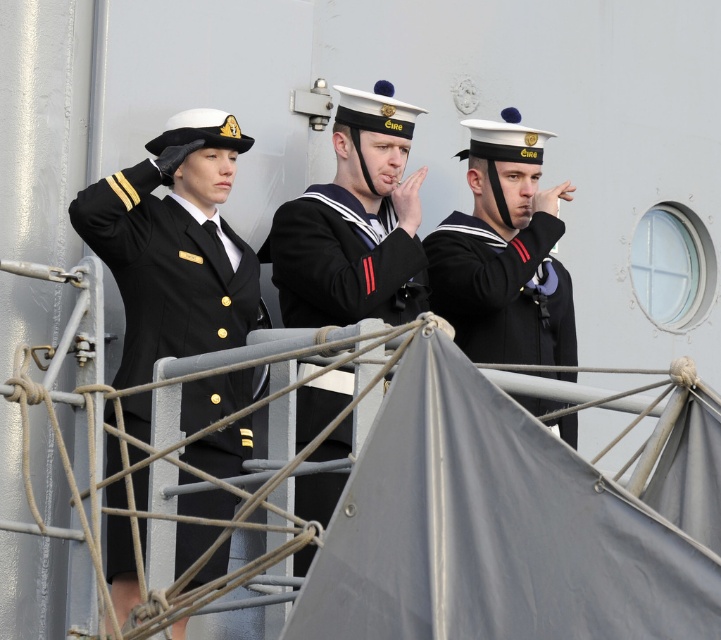
From the picture: Who is higher up, black woolen sweater at center or sailor uniform at center?

Positioned higher is black woolen sweater at center.

Who is more distant from viewer, (394, 243) or (461, 348)?

The point (461, 348) is more distant.

Does point (300, 323) lie behind point (448, 273)?

No.

You are a GUI agent. You are given a task and a screenshot of the screen. Output one action in this format:
    pyautogui.click(x=<x>, y=<y>)
    Task: Click on the black woolen sweater at center
    
    Given the screenshot: What is the action you would take?
    pyautogui.click(x=342, y=260)

Does black matte uniform at left have a lesser width compared to black woolen sweater at center?

Yes, black matte uniform at left is thinner than black woolen sweater at center.

Describe the element at coordinates (164, 269) in the screenshot. I see `black matte uniform at left` at that location.

Is point (203, 545) farther from viewer compared to point (329, 230)?

No, it is not.

Image resolution: width=721 pixels, height=640 pixels. What are the coordinates of `black matte uniform at left` in the screenshot? It's located at (164, 269).

Is black matte uniform at left bigger than sailor uniform at center?

Indeed, black matte uniform at left has a larger size compared to sailor uniform at center.

Between black matte uniform at left and sailor uniform at center, which one has more height?

Standing taller between the two is black matte uniform at left.

Does point (230, 266) come in front of point (477, 260)?

That is True.

The width and height of the screenshot is (721, 640). I want to click on black matte uniform at left, so click(x=164, y=269).